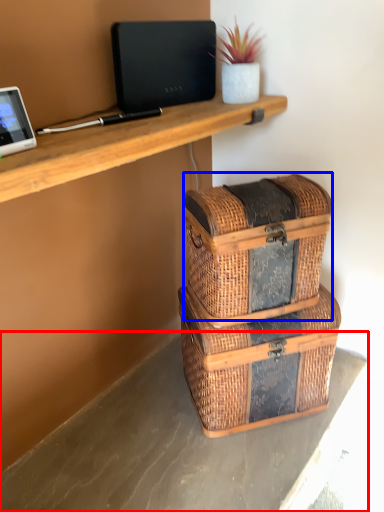
Question: Which point is closer to the camera, concrete (highlighted by a red box) or storage box (highlighted by a blue box)?

Choices:
 (A) concrete
 (B) storage box

Answer: (A)